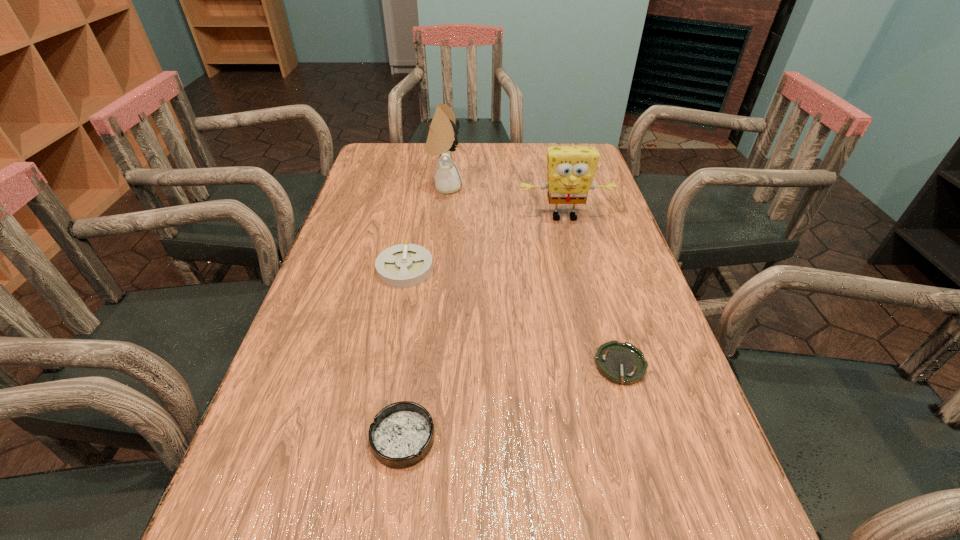
Find the location of a particular element. the tallest object is located at coordinates (442, 138).

Identify the location of doll. (442, 138).

This screenshot has width=960, height=540. Identify the location of the fourth nearest object. (571, 169).

You are a GUI agent. You are given a task and a screenshot of the screen. Output one action in this format:
    pyautogui.click(x=<x>, y=<y>)
    Task: Click on the sponge
    The height and width of the screenshot is (540, 960).
    Given the screenshot: What is the action you would take?
    pyautogui.click(x=571, y=169)

At what (x,y) coordinates should I click in order to perform the action: click on the third farthest object. Please return your answer as a coordinate pair (x, y). The image size is (960, 540). Looking at the image, I should click on (404, 265).

The width and height of the screenshot is (960, 540). What are the coordinates of `the farthest ashtray` in the screenshot? It's located at (404, 265).

You are a GUI agent. You are given a task and a screenshot of the screen. Output one action in this format:
    pyautogui.click(x=<x>, y=<y>)
    Task: Click on the fourth tallest object
    The width and height of the screenshot is (960, 540).
    Given the screenshot: What is the action you would take?
    pyautogui.click(x=402, y=434)

What are the coordinates of `the second tallest ashtray` in the screenshot? It's located at (402, 434).

Where is `the second nearest ashtray`? The width and height of the screenshot is (960, 540). the second nearest ashtray is located at coordinates (621, 363).

Where is `the shortest object`? the shortest object is located at coordinates (621, 363).